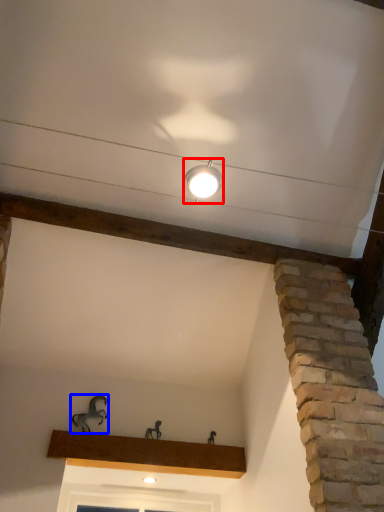
Question: Which of the following is the closest to the observer, lamp (highlighted by a red box) or animal (highlighted by a blue box)?

Choices:
 (A) lamp
 (B) animal

Answer: (A)